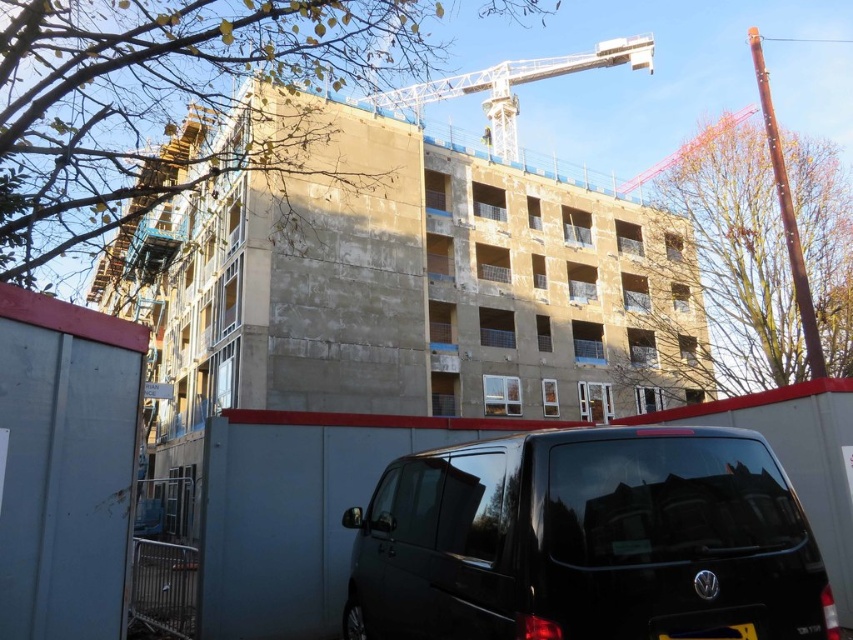
Question: Which object appears closest to the camera in this image?

Choices:
 (A) black matte van at lower center
 (B) yellow plastic license plate at lower center

Answer: (A)

Question: Is black matte van at lower center to the left of white metallic crane at upper center from the viewer's perspective?

Choices:
 (A) no
 (B) yes

Answer: (B)

Question: Does black matte van at lower center have a smaller size compared to yellow plastic license plate at lower center?

Choices:
 (A) no
 (B) yes

Answer: (A)

Question: Which object appears farthest from the camera in this image?

Choices:
 (A) black matte van at lower center
 (B) white metallic crane at upper center
 (C) yellow plastic license plate at lower center

Answer: (B)

Question: Which point appears closest to the camera in this image?

Choices:
 (A) (735, 456)
 (B) (730, 637)
 (C) (509, 102)

Answer: (B)

Question: Does black matte van at lower center have a lesser width compared to white metallic crane at upper center?

Choices:
 (A) yes
 (B) no

Answer: (A)